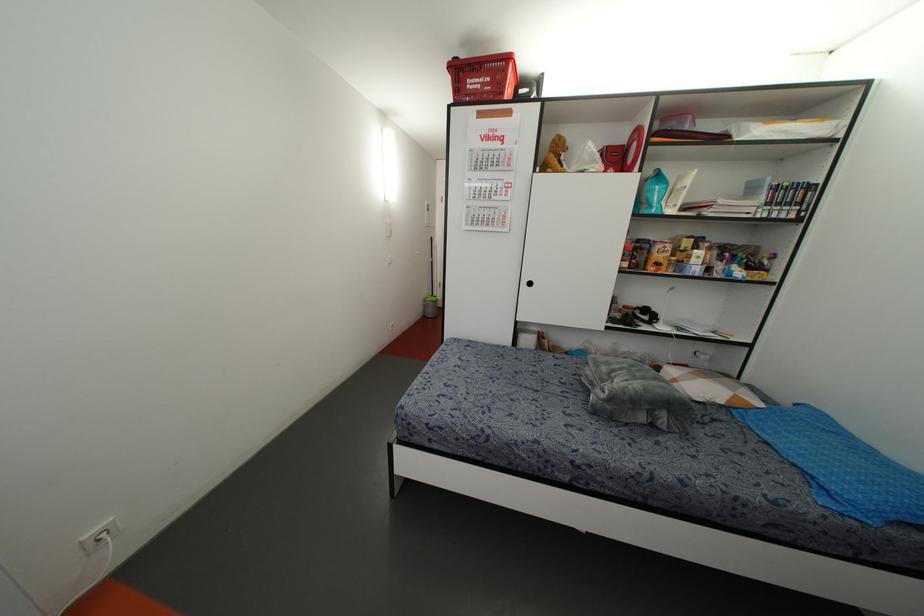
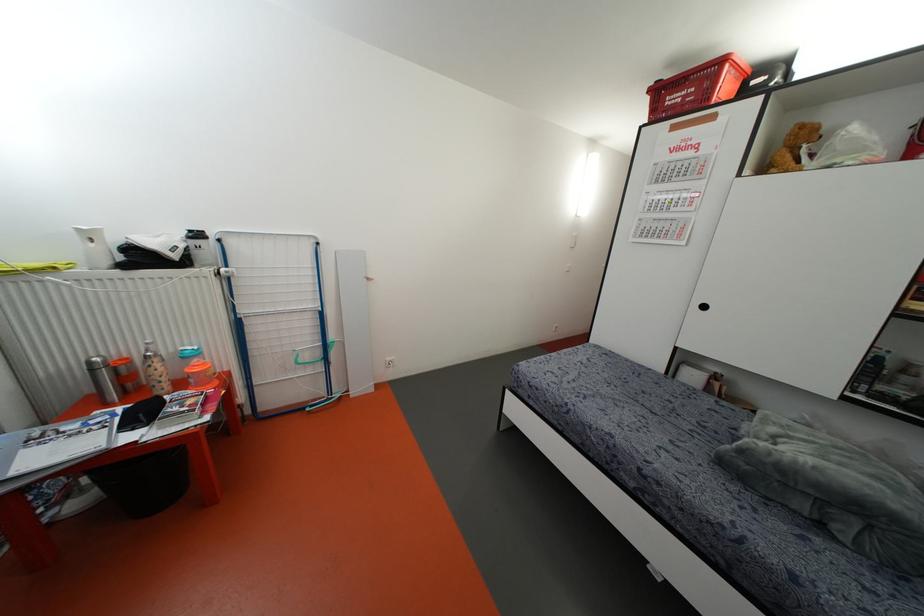
In the second image, find the point that corresponds to (529,283) in the first image.

(703, 307)